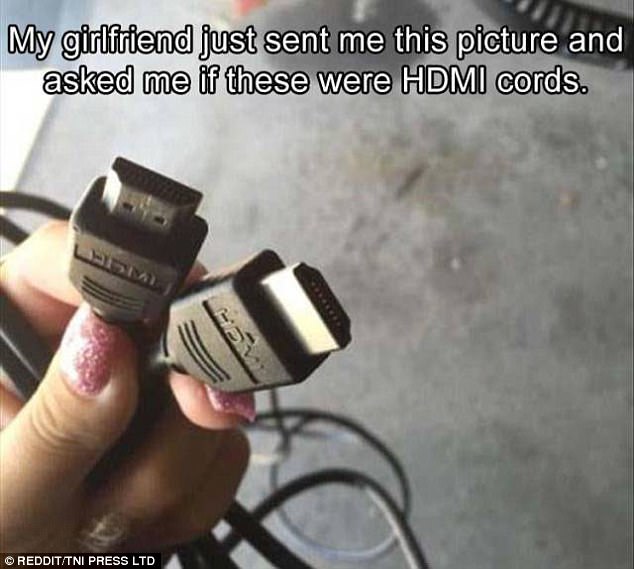
Where is `hdmi cable connectors`? The width and height of the screenshot is (634, 569). hdmi cable connectors is located at coordinates (246, 310), (163, 279), (188, 568).